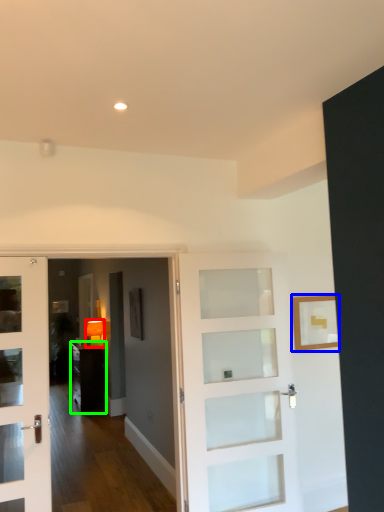
Question: Which is nearer to the lamp (highlighted by a red box)? picture frame (highlighted by a blue box) or furniture (highlighted by a green box).

Choices:
 (A) picture frame
 (B) furniture

Answer: (B)